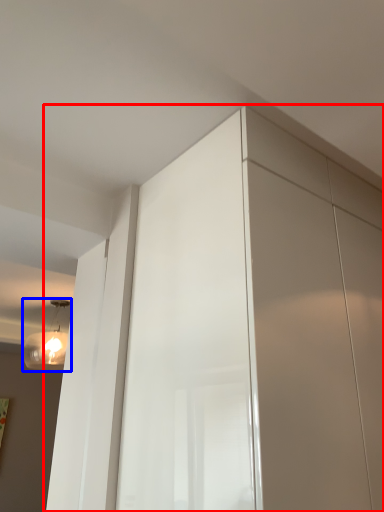
Question: Among these objects, which one is farthest to the camera, dresser (highlighted by a red box) or light fixture (highlighted by a blue box)?

Choices:
 (A) dresser
 (B) light fixture

Answer: (B)